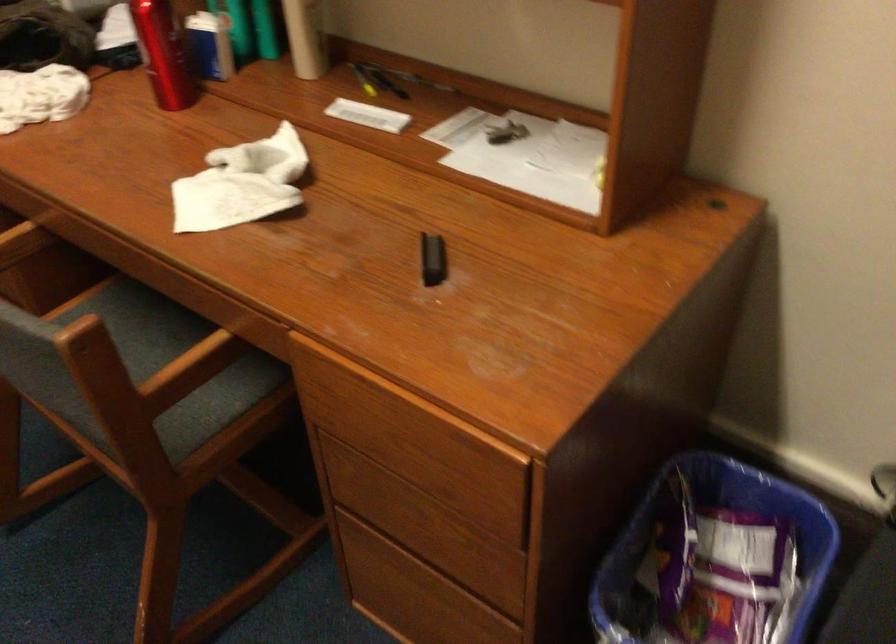
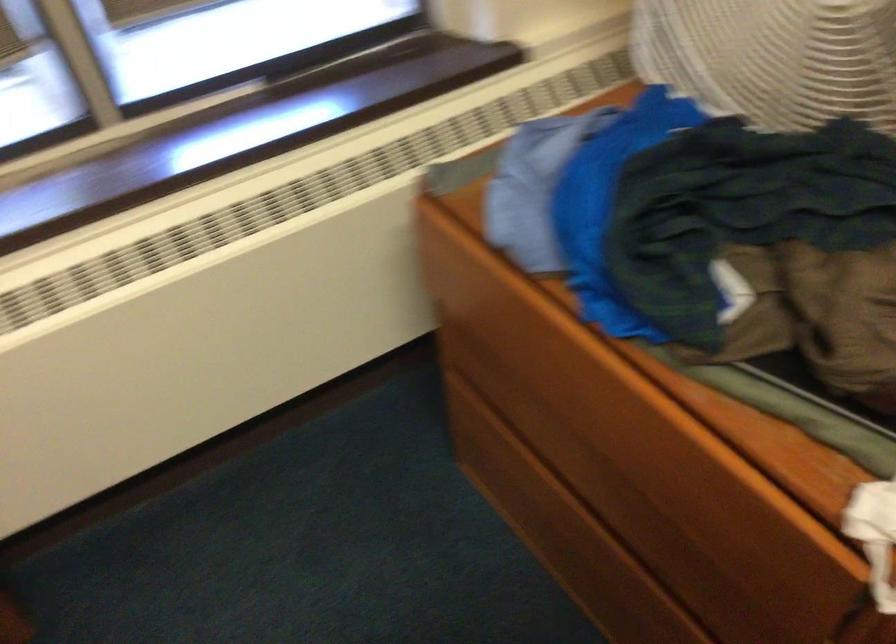
Which direction would the cameraman need to move to produce the second image?

The cameraman walked toward left, forward.